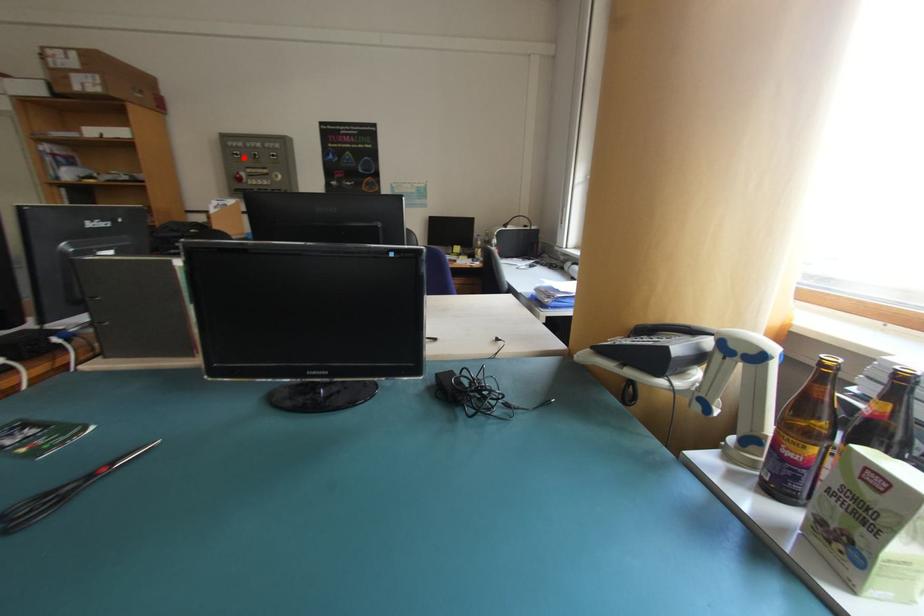
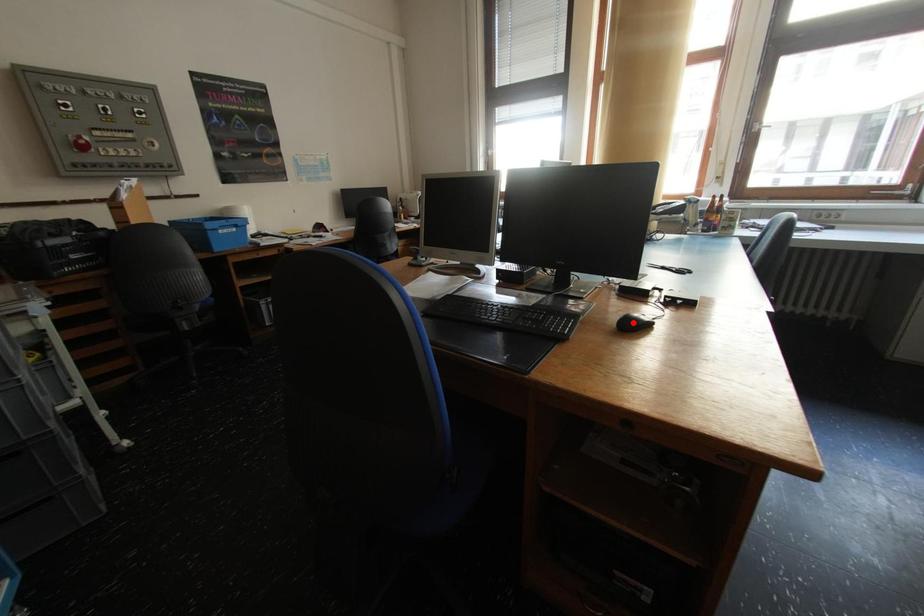
I am providing you with two images of the same scene from different viewpoints. A red point is marked on the first image and another point is marked on the second image. Do the highlighted points in image1 and image2 indicate the same real-world spot?

No